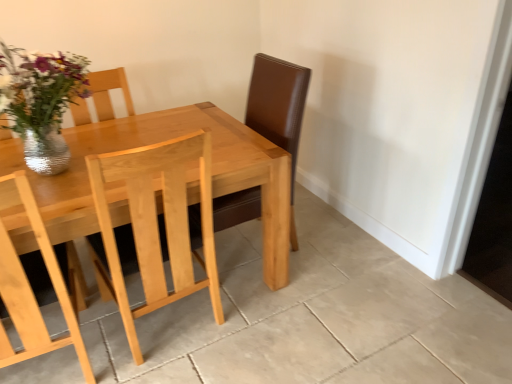
Identify the location of vacant point to the right of light wood chair at center. The width and height of the screenshot is (512, 384). (269, 332).